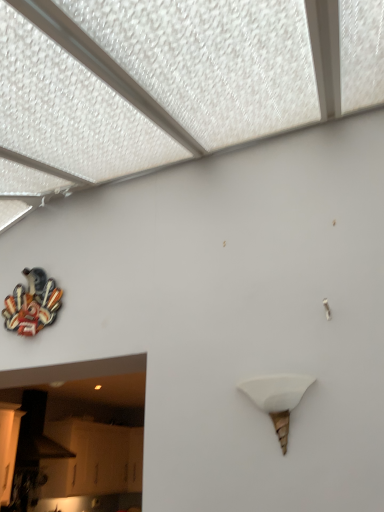
Question: Is point (46, 280) positioned closer to the camera than point (276, 410)?

Choices:
 (A) farther
 (B) closer

Answer: (A)

Question: Considering the positions of metallic/multicolored sculpture at upper left and white matte cone at center-right in the image, is metallic/multicolored sculpture at upper left taller or shorter than white matte cone at center-right?

Choices:
 (A) short
 (B) tall

Answer: (B)

Question: From a real-world perspective, is metallic/multicolored sculpture at upper left physically located above or below white matte cone at center-right?

Choices:
 (A) below
 (B) above

Answer: (B)

Question: Is point (296, 393) positioned closer to the camera than point (48, 301)?

Choices:
 (A) closer
 (B) farther

Answer: (A)

Question: Is white matte cone at center-right taller or shorter than metallic/multicolored sculpture at upper left?

Choices:
 (A) tall
 (B) short

Answer: (B)

Question: Is white matte cone at center-right wider or thinner than metallic/multicolored sculpture at upper left?

Choices:
 (A) thin
 (B) wide

Answer: (B)

Question: From the image's perspective, is white matte cone at center-right positioned above or below metallic/multicolored sculpture at upper left?

Choices:
 (A) below
 (B) above

Answer: (A)